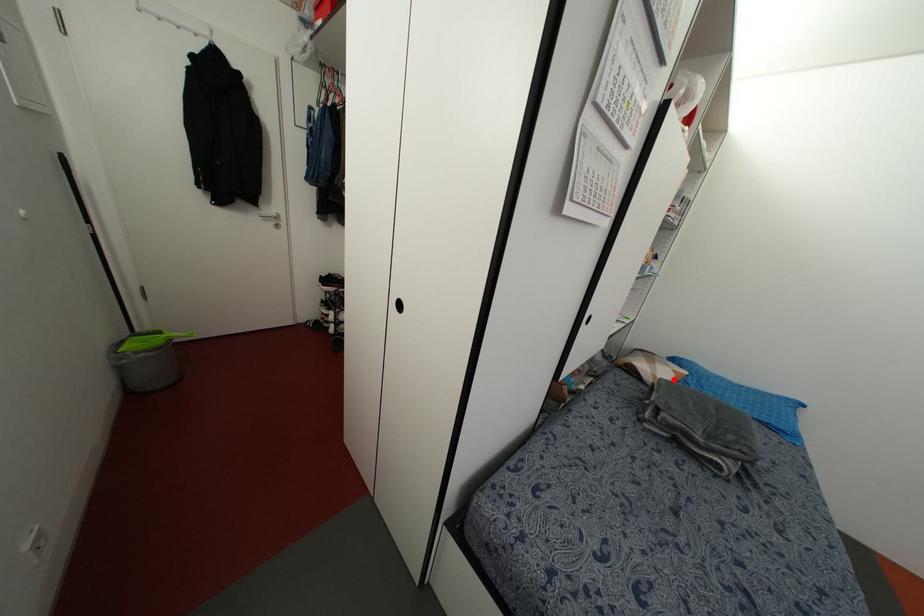
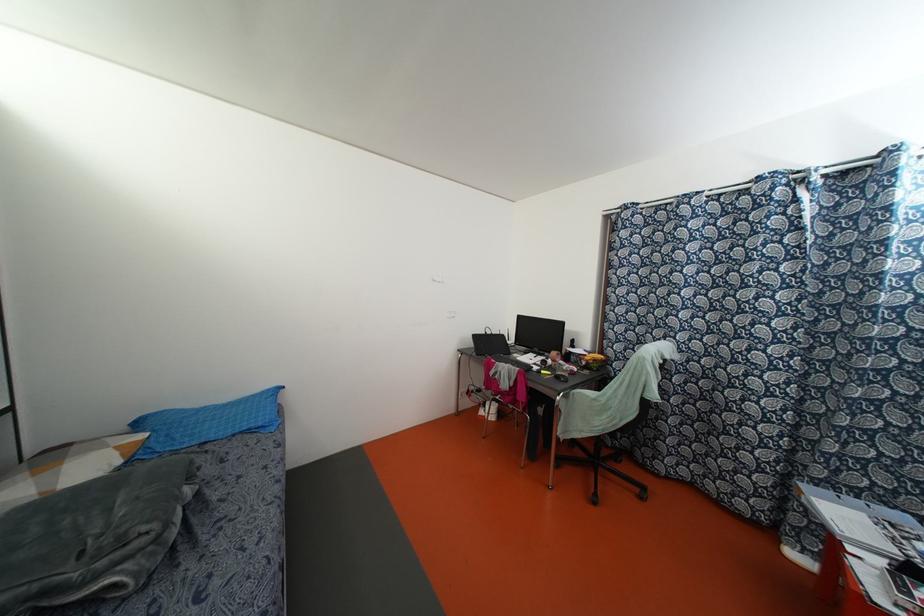
Where in the second image is the point corresponding to the highlighted location from the first image?

(118, 461)